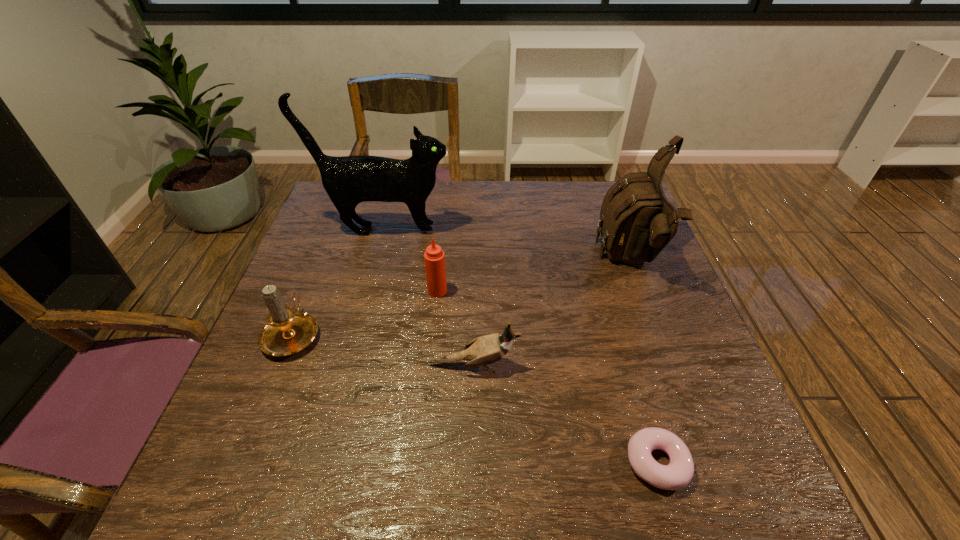
I want to click on vacant space that satisfies the following two spatial constraints: 1. on the face of the cat; 2. on the left side of the doughnut, so tap(322, 463).

Locate an element on the screen. Image resolution: width=960 pixels, height=540 pixels. vacant space that satisfies the following two spatial constraints: 1. on the front-facing side of the fifth shortest object; 2. on the front side of the shortest object is located at coordinates (708, 463).

At what (x,y) coordinates should I click in order to perform the action: click on vacant space that satisfies the following two spatial constraints: 1. on the face of the nearest object; 2. on the right side of the cat. Please return your answer as a coordinate pair (x, y). Image resolution: width=960 pixels, height=540 pixels. Looking at the image, I should click on (322, 463).

This screenshot has width=960, height=540. What are the coordinates of `free space in the image that satisfies the following two spatial constraints: 1. on the face of the cat; 2. on the right side of the doughnut` in the screenshot? It's located at (322, 463).